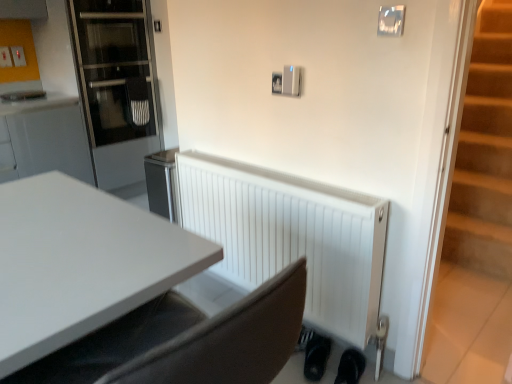
Question: Considering the positions of black rubber shoe at lower right, which appears as the second shoe when viewed from the left, and black matte shoe at lower right, positioned as the 1th shoe in left-to-right order, in the image, is black rubber shoe at lower right, which appears as the second shoe when viewed from the left, wider or thinner than black matte shoe at lower right, positioned as the 1th shoe in left-to-right order,?

Choices:
 (A) thin
 (B) wide

Answer: (A)

Question: Considering the positions of black rubber shoe at lower right, the first shoe from the right, and black matte shoe at lower right, the second shoe positioned from the right, in the image, is black rubber shoe at lower right, the first shoe from the right, bigger or smaller than black matte shoe at lower right, the second shoe positioned from the right,?

Choices:
 (A) small
 (B) big

Answer: (A)

Question: Which object is the closest to the white glossy desk at center?

Choices:
 (A) white matte radiator at lower center
 (B) transparent glass door at left
 (C) black rubber shoe at lower right, which appears as the second shoe when viewed from the left
 (D) black matte shoe at lower right, the second shoe positioned from the right

Answer: (A)

Question: Which object is positioned farthest from the black matte shoe at lower right, positioned as the 1th shoe in left-to-right order?

Choices:
 (A) black rubber shoe at lower right, the first shoe from the right
 (B) white glossy desk at center
 (C) white matte radiator at lower center
 (D) transparent glass door at left

Answer: (D)